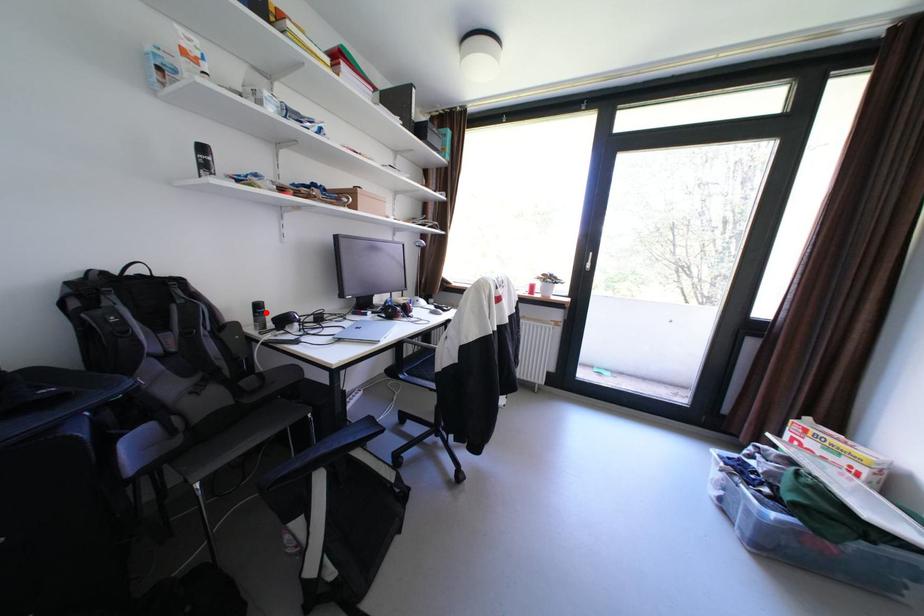
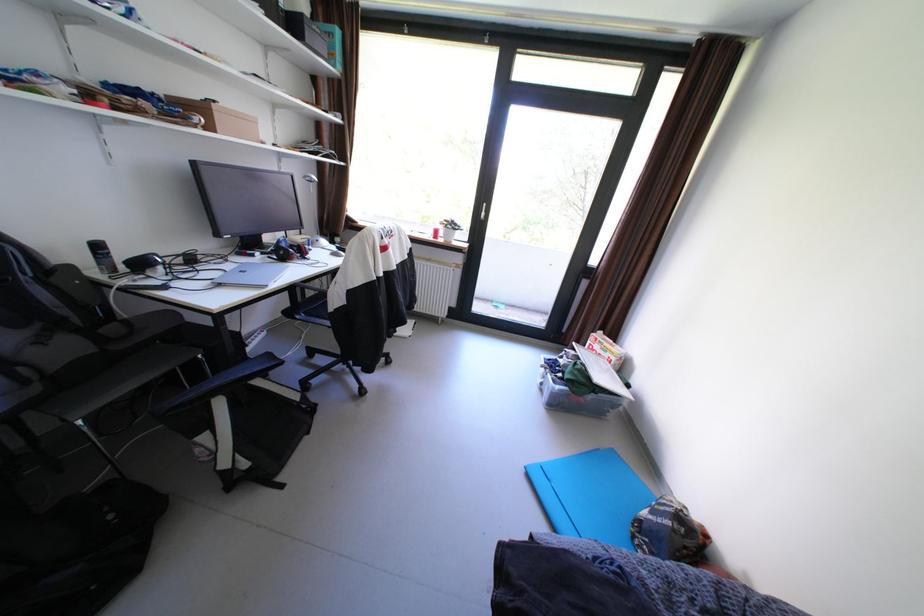
In the second image, find the point that corresponds to the highlighted location in the first image.

(106, 254)